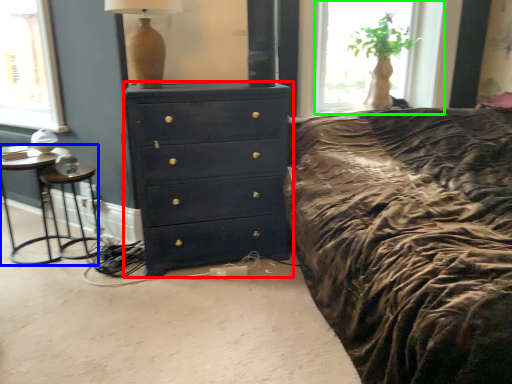
Question: Which object is the closest to the chest of drawers (highlighted by a red box)? Choose among these: nightstand (highlighted by a blue box) or window (highlighted by a green box).

Choices:
 (A) nightstand
 (B) window

Answer: (A)